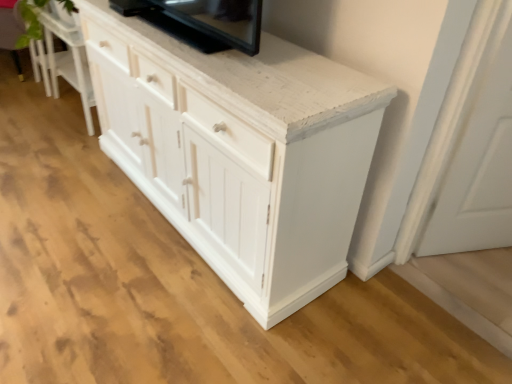
Question: Can you confirm if black glossy tv at upper center is thinner than white painted wood cabinet at center?

Choices:
 (A) yes
 (B) no

Answer: (A)

Question: Considering the relative sizes of black glossy tv at upper center and white painted wood cabinet at center in the image provided, is black glossy tv at upper center taller than white painted wood cabinet at center?

Choices:
 (A) no
 (B) yes

Answer: (B)

Question: Is black glossy tv at upper center at the right side of white painted wood cabinet at center?

Choices:
 (A) no
 (B) yes

Answer: (B)

Question: Is black glossy tv at upper center beside white painted wood cabinet at center?

Choices:
 (A) yes
 (B) no

Answer: (B)

Question: Is black glossy tv at upper center surrounding white painted wood cabinet at center?

Choices:
 (A) no
 (B) yes

Answer: (A)

Question: Is the position of black glossy tv at upper center more distant than that of white painted wood cabinet at center?

Choices:
 (A) no
 (B) yes

Answer: (B)

Question: Is green leafy plant at upper left oriented towards black glossy tv at upper center?

Choices:
 (A) yes
 (B) no

Answer: (B)

Question: Is green leafy plant at upper left at the right side of black glossy tv at upper center?

Choices:
 (A) yes
 (B) no

Answer: (B)

Question: Does green leafy plant at upper left have a larger size compared to black glossy tv at upper center?

Choices:
 (A) yes
 (B) no

Answer: (A)

Question: Is green leafy plant at upper left wider than black glossy tv at upper center?

Choices:
 (A) no
 (B) yes

Answer: (B)

Question: Is green leafy plant at upper left behind black glossy tv at upper center?

Choices:
 (A) no
 (B) yes

Answer: (B)

Question: Can you confirm if green leafy plant at upper left is taller than black glossy tv at upper center?

Choices:
 (A) yes
 (B) no

Answer: (A)

Question: Does white matte door at lower right appear on the right side of white wood cabinet at lower left?

Choices:
 (A) no
 (B) yes

Answer: (B)